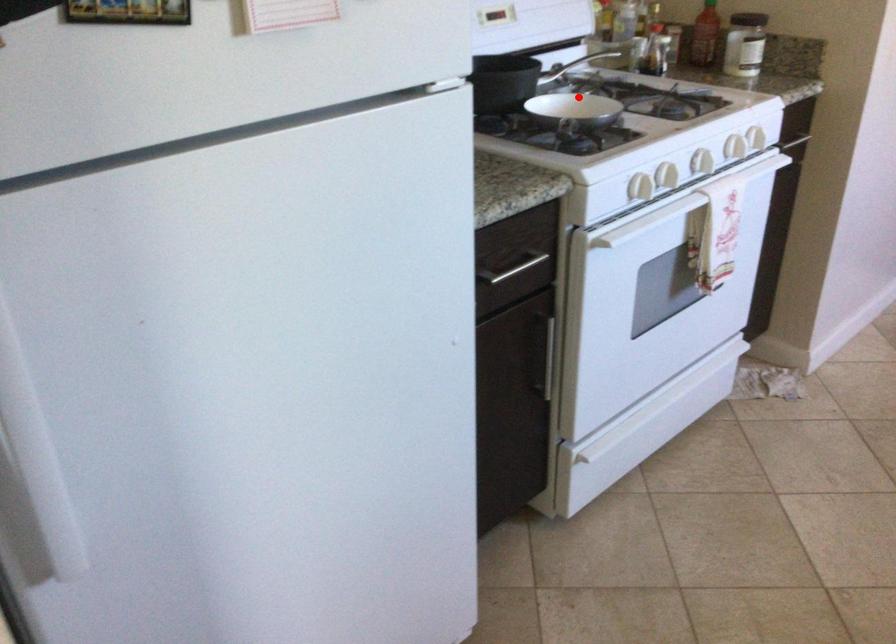
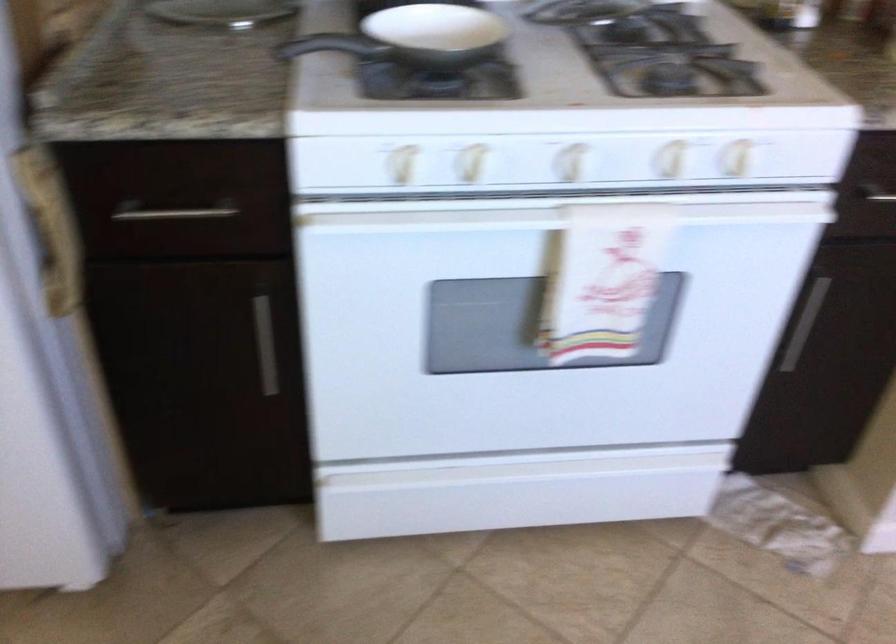
Where in the second image is the point corresponding to the highlighted location from the first image?

(315, 44)